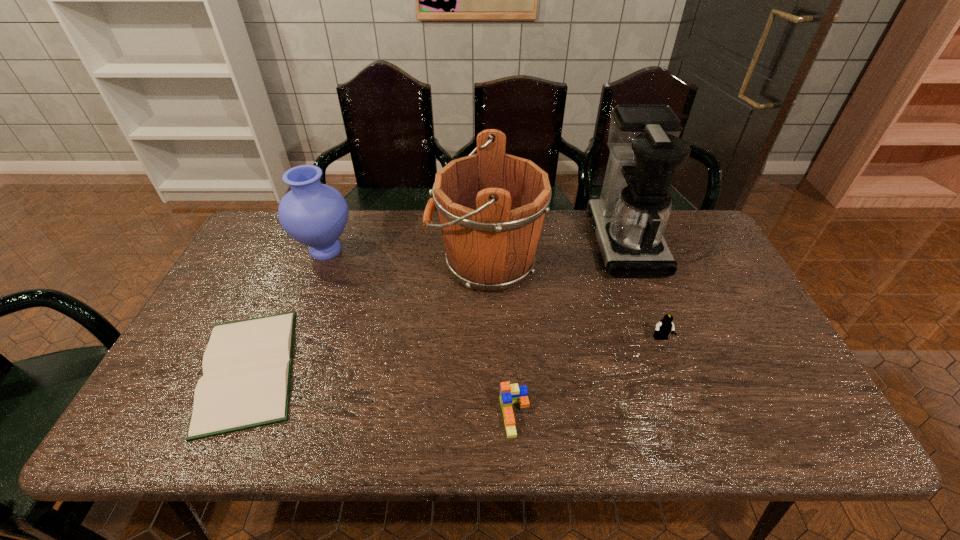
This screenshot has width=960, height=540. I want to click on unoccupied position between the third shortest object and the second shortest object, so click(588, 377).

Image resolution: width=960 pixels, height=540 pixels. What are the coordinates of `free space between the shortest object and the fourth tallest object` in the screenshot? It's located at (454, 354).

The image size is (960, 540). What are the coordinates of `free space between the right Lego and the hardback book` in the screenshot? It's located at (454, 354).

Find the location of `vacant area that lies between the bucket and the third tallest object`. vacant area that lies between the bucket and the third tallest object is located at coordinates (405, 257).

This screenshot has width=960, height=540. What are the coordinates of `free space between the coffee maker and the farther Lego` in the screenshot? It's located at (642, 290).

Identify the location of unoccupied position between the right Lego and the vase. (493, 294).

Identify the location of vacant area that lies between the third tallest object and the fourth tallest object. This screenshot has width=960, height=540. click(x=493, y=294).

The width and height of the screenshot is (960, 540). What are the coordinates of `blank region between the vase and the bucket` in the screenshot? It's located at (405, 257).

Locate an element on the screen. Image resolution: width=960 pixels, height=540 pixels. vacant area that lies between the fourth shortest object and the hardback book is located at coordinates (287, 310).

Find the location of a particular element. empty location between the taller Lego and the nearer Lego is located at coordinates (588, 377).